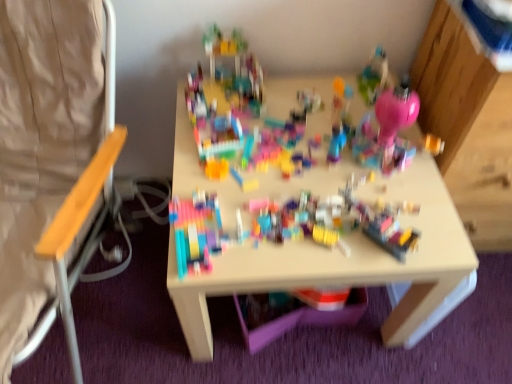
This screenshot has width=512, height=384. Identify the location of vacant space to the right of translucent plastic container at center, which is the 1th toy from right to left. (434, 235).